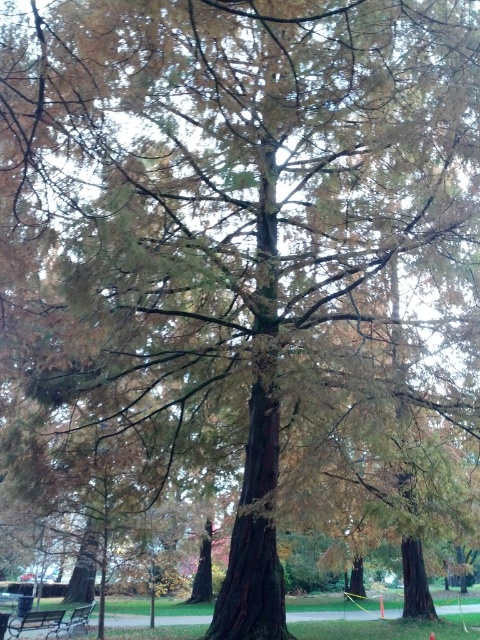
Is metallic silver bench at lower left thinner than wooden bench at lower left?

In fact, metallic silver bench at lower left might be wider than wooden bench at lower left.

Is metallic silver bench at lower left below wooden bench at lower left?

No, metallic silver bench at lower left is not below wooden bench at lower left.

This screenshot has width=480, height=640. I want to click on metallic silver bench at lower left, so click(36, 621).

Does point (28, 618) come closer to viewer compared to point (4, 627)?

No.

Can you confirm if metallic silver bench at lower left is positioned to the left of wooden picnic table at lower left?

In fact, metallic silver bench at lower left is to the right of wooden picnic table at lower left.

I want to click on metallic silver bench at lower left, so click(x=36, y=621).

Consider the image. Is wooden bench at lower left positioned in front of wooden picnic table at lower left?

That is False.

Which of these two, wooden bench at lower left or wooden picnic table at lower left, stands taller?

With more height is wooden picnic table at lower left.

Between point (66, 632) and point (1, 611), which one is positioned behind?

The point (1, 611) is more distant.

I want to click on wooden bench at lower left, so click(x=76, y=620).